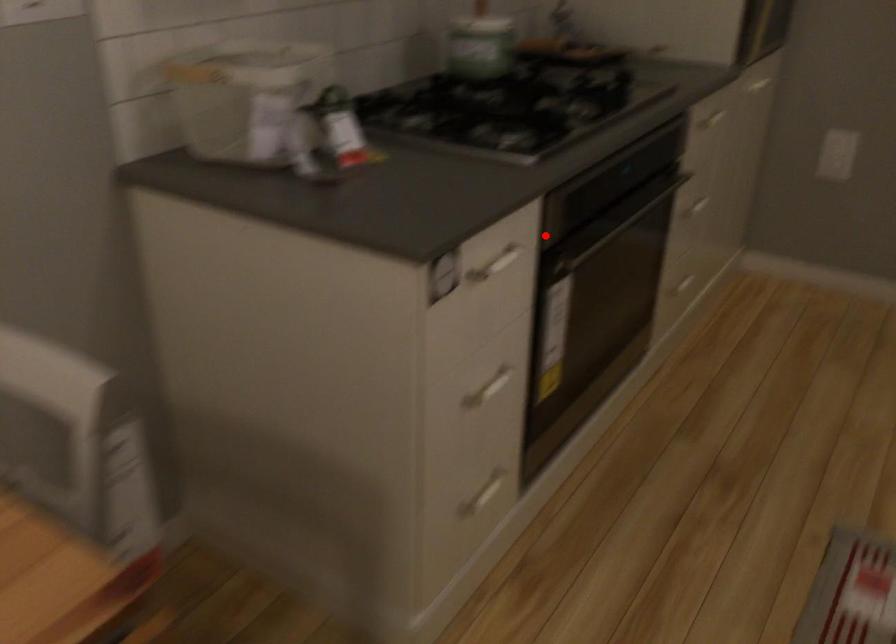
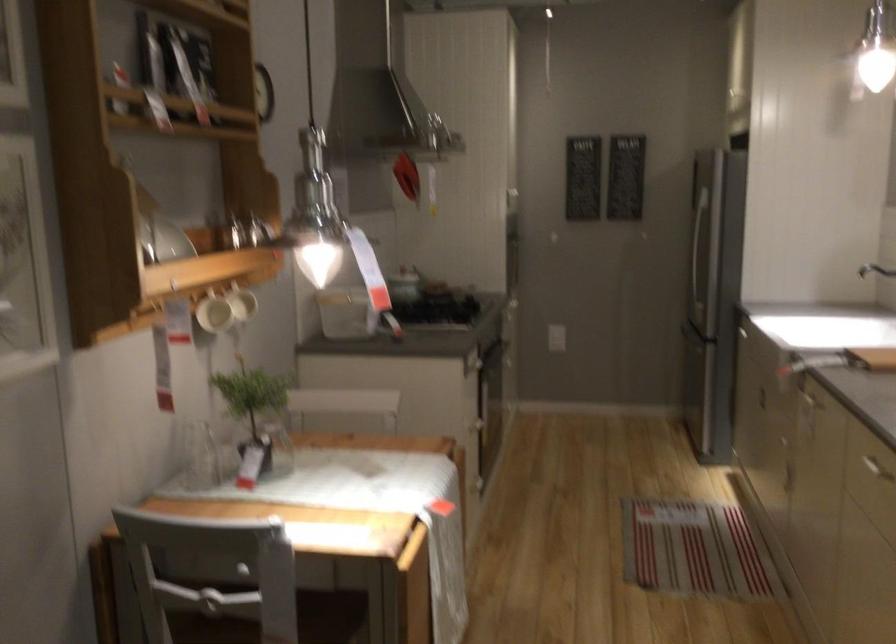
Question: A red point is marked in image1. In image2, is the corresponding 3D point closer to the camera or farther? Reply with the corresponding letter.

Choices:
 (A) The corresponding 3D point is closer.
 (B) The corresponding 3D point is farther.

Answer: (B)